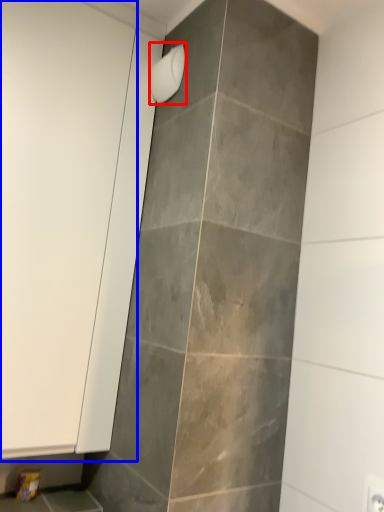
Question: Which point is closer to the camera, shower (highlighted by a red box) or screen door (highlighted by a blue box)?

Choices:
 (A) shower
 (B) screen door

Answer: (B)